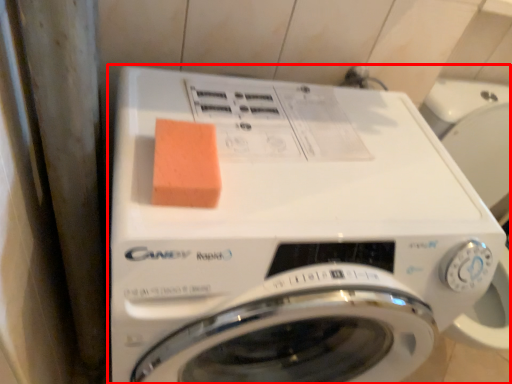
Question: In this image, where is washing machine (annotated by the red box) located relative to food?

Choices:
 (A) right
 (B) left

Answer: (A)